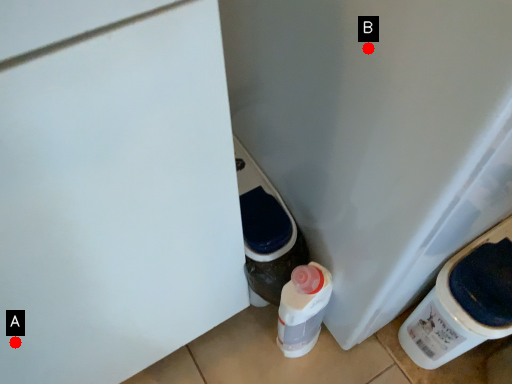
Question: Two points are circled on the image, labeled by A and B beside each circle. Which point is farther to the camera?

Choices:
 (A) A is further
 (B) B is further

Answer: (A)